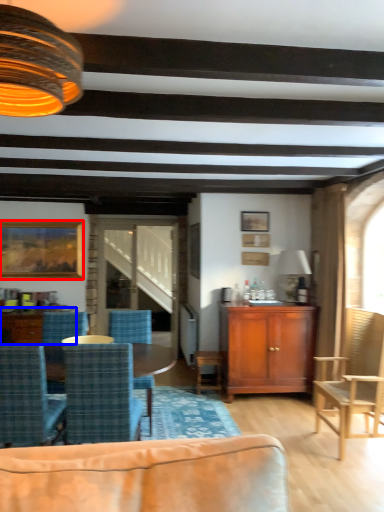
Question: Which object appears closest to the camera in this image, picture frame (highlighted by a red box) or coffee table (highlighted by a blue box)?

Choices:
 (A) picture frame
 (B) coffee table

Answer: (B)